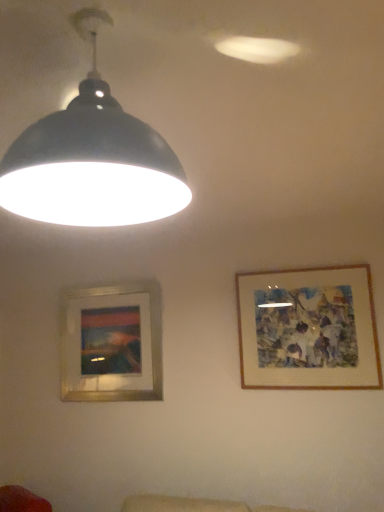
Question: Is matte black lampshade at upper left wider than wooden-framed artwork at upper right, acting as the 2th picture frame starting from the back?

Choices:
 (A) yes
 (B) no

Answer: (A)

Question: Does matte black lampshade at upper left have a larger size compared to wooden-framed artwork at upper right, acting as the 2th picture frame starting from the back?

Choices:
 (A) yes
 (B) no

Answer: (A)

Question: From the image's perspective, is matte black lampshade at upper left on top of wooden-framed artwork at upper right, the first picture frame positioned from the right?

Choices:
 (A) no
 (B) yes

Answer: (B)

Question: From a real-world perspective, is matte black lampshade at upper left on top of wooden-framed artwork at upper right, which appears as the second picture frame when viewed from the left?

Choices:
 (A) yes
 (B) no

Answer: (A)

Question: Does matte black lampshade at upper left have a lesser width compared to wooden-framed artwork at upper right, which ranks as the first picture frame in front-to-back order?

Choices:
 (A) yes
 (B) no

Answer: (B)

Question: From their relative heights in the image, would you say matte black lampshade at upper left is taller or shorter than wooden-framed artwork at upper right, acting as the 2th picture frame starting from the back?

Choices:
 (A) short
 (B) tall

Answer: (A)

Question: From the image's perspective, is matte black lampshade at upper left located above or below wooden-framed artwork at upper right, which appears as the second picture frame when viewed from the left?

Choices:
 (A) above
 (B) below

Answer: (A)

Question: Looking at the image, does matte black lampshade at upper left seem bigger or smaller compared to wooden-framed artwork at upper right, which ranks as the first picture frame in front-to-back order?

Choices:
 (A) small
 (B) big

Answer: (B)

Question: From a real-world perspective, is matte black lampshade at upper left physically located above or below wooden-framed artwork at upper right, which ranks as the first picture frame in front-to-back order?

Choices:
 (A) below
 (B) above

Answer: (B)

Question: Is wooden-framed artwork at upper right, which appears as the second picture frame when viewed from the left, in front of or behind silver metallic picture frame at lower left, arranged as the 2th picture frame when viewed from the front, in the image?

Choices:
 (A) front
 (B) behind

Answer: (A)

Question: Does point (248, 274) appear closer or farther from the camera than point (62, 379)?

Choices:
 (A) closer
 (B) farther

Answer: (A)

Question: Is wooden-framed artwork at upper right, which ranks as the first picture frame in front-to-back order, inside or outside of silver metallic picture frame at lower left, which ranks as the second picture frame in right-to-left order?

Choices:
 (A) outside
 (B) inside

Answer: (A)

Question: In terms of height, does wooden-framed artwork at upper right, which ranks as the first picture frame in front-to-back order, look taller or shorter compared to silver metallic picture frame at lower left, which ranks as the second picture frame in right-to-left order?

Choices:
 (A) tall
 (B) short

Answer: (B)

Question: Considering the relative positions of silver metallic picture frame at lower left, the first picture frame viewed from the left, and matte black lampshade at upper left in the image provided, is silver metallic picture frame at lower left, the first picture frame viewed from the left, to the left or to the right of matte black lampshade at upper left?

Choices:
 (A) left
 (B) right

Answer: (A)

Question: Is point (109, 372) positioned closer to the camera than point (61, 158)?

Choices:
 (A) farther
 (B) closer

Answer: (A)